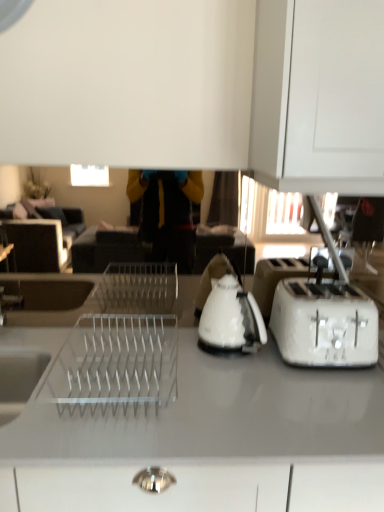
Where is `free space that is in between white plastic toaster at right and white glossy kettle at center`? free space that is in between white plastic toaster at right and white glossy kettle at center is located at coordinates (258, 364).